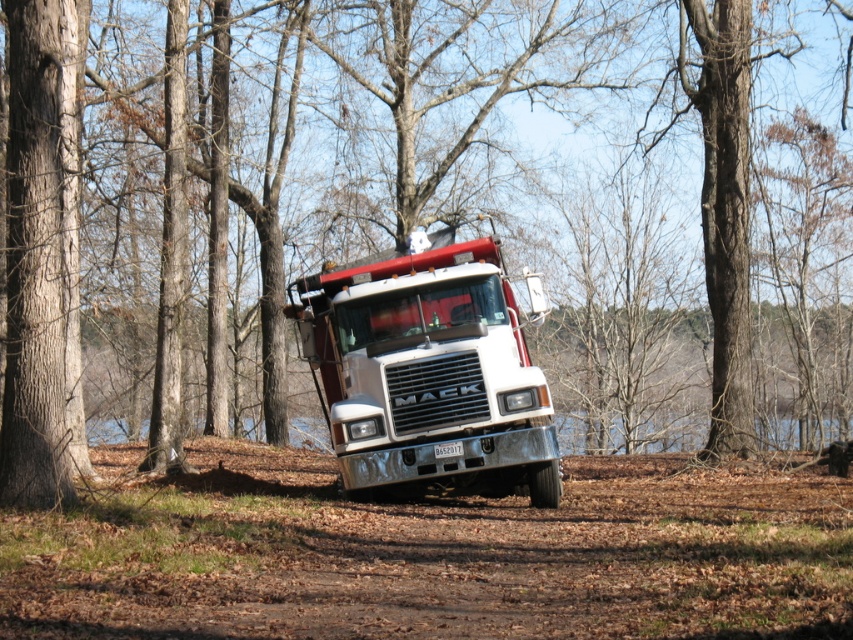
Question: Which object is farther from the camera taking this photo?

Choices:
 (A) white metallic truck at center
 (B) brown dirt track at center

Answer: (A)

Question: Which point is farther to the camera?

Choices:
 (A) (33, 561)
 (B) (463, 312)

Answer: (B)

Question: Can you confirm if brown dirt track at center is positioned below white metallic truck at center?

Choices:
 (A) no
 (B) yes

Answer: (B)

Question: Is brown dirt track at center bigger than white metallic truck at center?

Choices:
 (A) yes
 (B) no

Answer: (A)

Question: Is brown dirt track at center wider than white metallic truck at center?

Choices:
 (A) no
 (B) yes

Answer: (B)